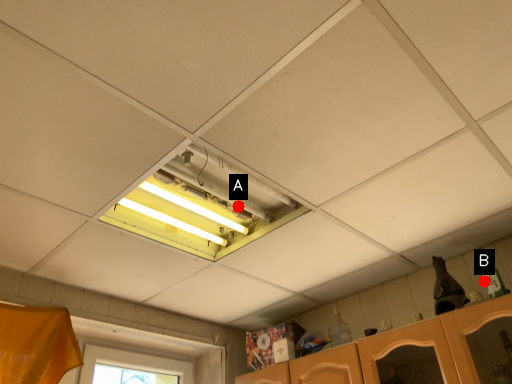
Question: Two points are circled on the image, labeled by A and B beside each circle. Which point is closer to the camera?

Choices:
 (A) A is closer
 (B) B is closer

Answer: (B)